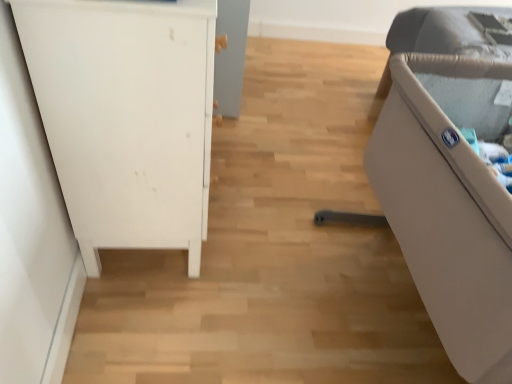
At what (x,y) coordinates should I click in order to perform the action: click on free space behind beige plastic crib at right, the second furniture from the left. Please return your answer as a coordinate pair (x, y). Looking at the image, I should click on (314, 159).